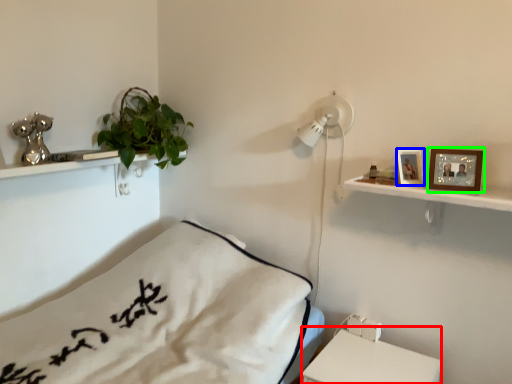
Question: Which object is positioned farthest from table (highlighted by a red box)? Select from picture frame (highlighted by a blue box) and picture frame (highlighted by a green box).

Choices:
 (A) picture frame
 (B) picture frame

Answer: (B)